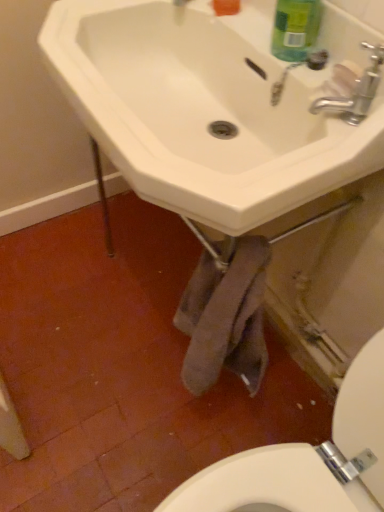
Question: Should I look upward or downward to see green matte bottle at upper right?

Choices:
 (A) down
 (B) up

Answer: (B)

Question: Is silver metallic faucet at upper right positioned beyond the bounds of green matte bottle at upper right?

Choices:
 (A) yes
 (B) no

Answer: (A)

Question: Can you confirm if silver metallic faucet at upper right is thinner than green matte bottle at upper right?

Choices:
 (A) no
 (B) yes

Answer: (A)

Question: Are silver metallic faucet at upper right and green matte bottle at upper right beside each other?

Choices:
 (A) no
 (B) yes

Answer: (A)

Question: Can green matte bottle at upper right be found inside silver metallic faucet at upper right?

Choices:
 (A) yes
 (B) no

Answer: (B)

Question: Is silver metallic faucet at upper right not near green matte bottle at upper right?

Choices:
 (A) no
 (B) yes

Answer: (A)

Question: Can you confirm if silver metallic faucet at upper right is shorter than green matte bottle at upper right?

Choices:
 (A) yes
 (B) no

Answer: (A)

Question: Is green matte bottle at upper right beside white ceramic sink at center?

Choices:
 (A) no
 (B) yes

Answer: (A)

Question: Can you confirm if green matte bottle at upper right is taller than white ceramic sink at center?

Choices:
 (A) yes
 (B) no

Answer: (B)

Question: Is green matte bottle at upper right not close to white ceramic sink at center?

Choices:
 (A) no
 (B) yes

Answer: (A)

Question: Is green matte bottle at upper right facing away from white ceramic sink at center?

Choices:
 (A) no
 (B) yes

Answer: (A)

Question: Can you confirm if green matte bottle at upper right is shorter than white ceramic sink at center?

Choices:
 (A) yes
 (B) no

Answer: (A)

Question: Could you tell me if green matte bottle at upper right is turned towards white ceramic sink at center?

Choices:
 (A) yes
 (B) no

Answer: (A)

Question: Is silver metallic faucet at upper right turned away from white ceramic sink at center?

Choices:
 (A) no
 (B) yes

Answer: (B)